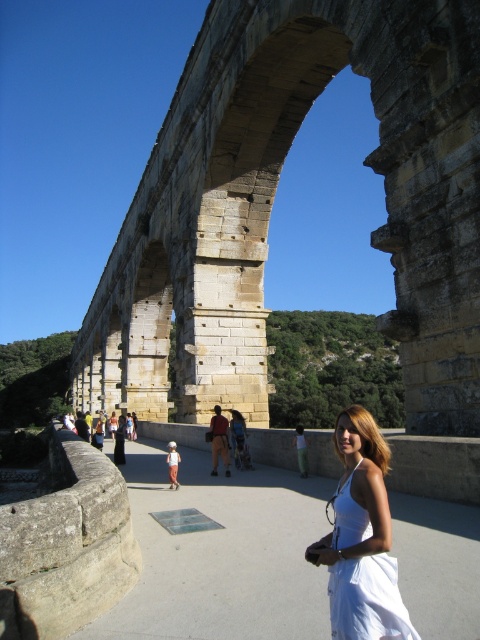
Question: Which point appears farthest from the camera in this image?

Choices:
 (A) (179, 154)
 (B) (414, 634)

Answer: (A)

Question: Can you confirm if stone arch bridge at center is positioned below brown leather jacket at center?

Choices:
 (A) no
 (B) yes

Answer: (A)

Question: Can you confirm if stone arch bridge at center is wider than brown leather jacket at center?

Choices:
 (A) no
 (B) yes

Answer: (B)

Question: Is the position of stone arch bridge at center more distant than that of brown leather jacket at center?

Choices:
 (A) yes
 (B) no

Answer: (B)

Question: Which of the following is the farthest from the observer?

Choices:
 (A) stone arch bridge at center
 (B) brown leather jacket at center

Answer: (B)

Question: Estimate the real-world distances between objects in this image. Which object is closer to the white cotton dress at center?

Choices:
 (A) stone arch bridge at center
 (B) brown leather jacket at center

Answer: (B)